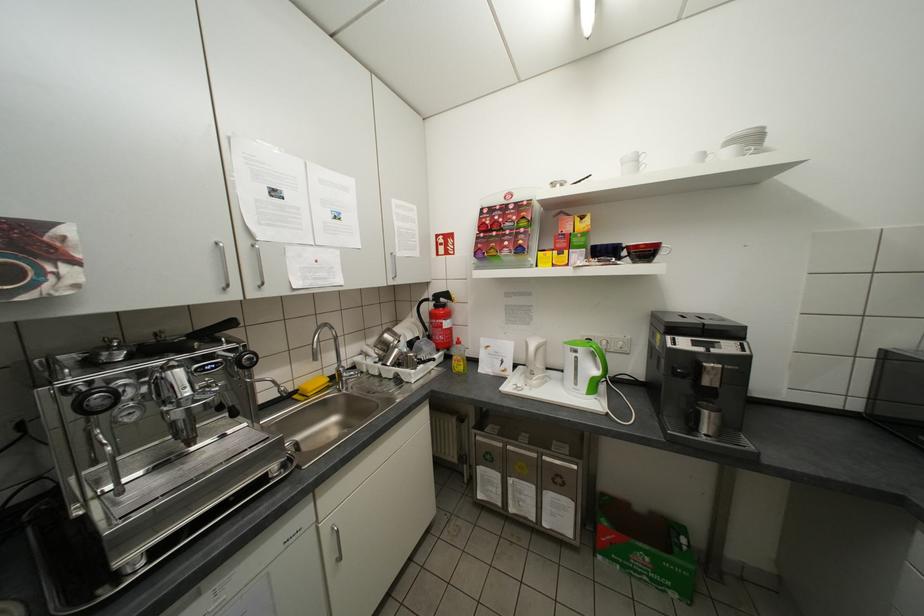
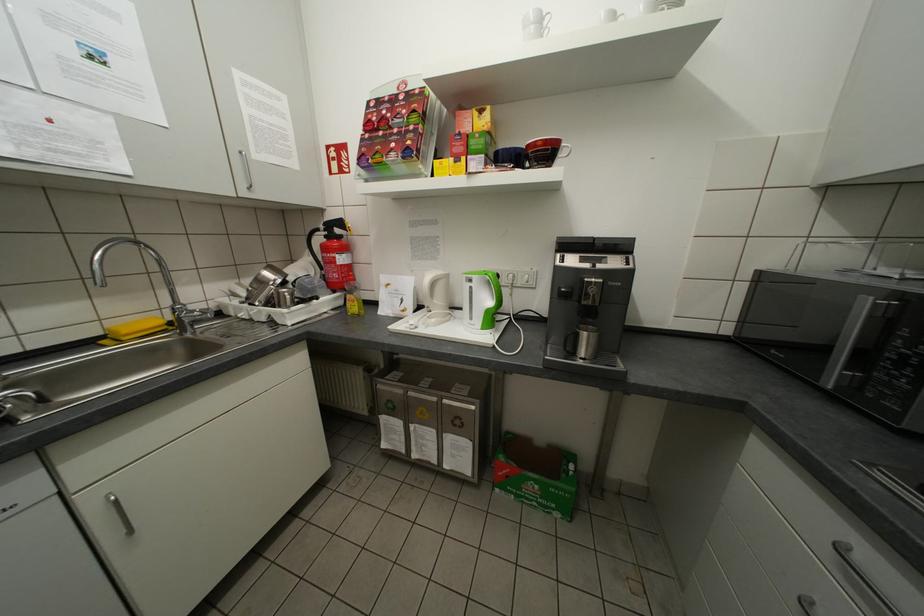
Where in the second image is the point corresponding to the point at 600,347 from the first image?

(494, 274)